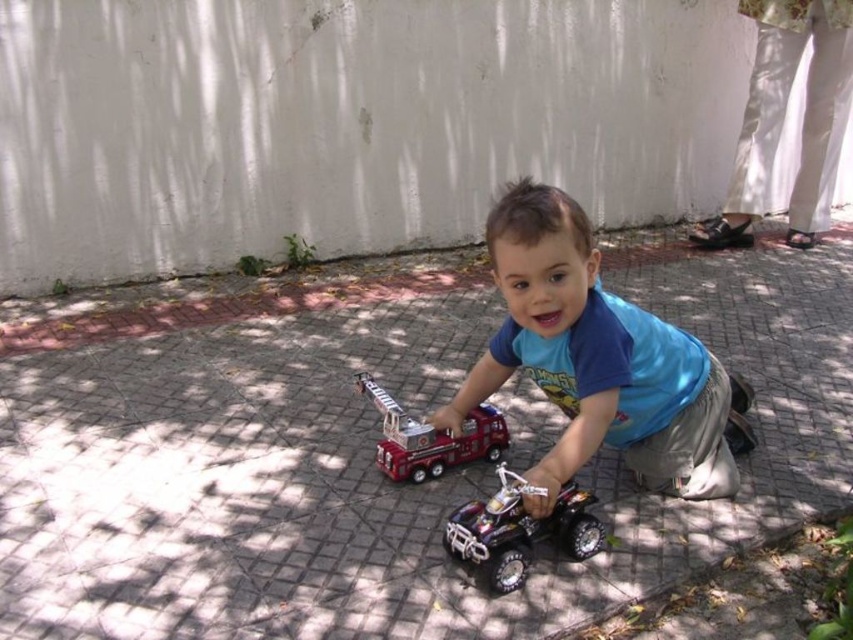
Does gray brick pavement at center have a lesser height compared to blue matte shirt at center?

In fact, gray brick pavement at center may be taller than blue matte shirt at center.

Can you confirm if gray brick pavement at center is positioned to the right of blue matte shirt at center?

Yes, gray brick pavement at center is to the right of blue matte shirt at center.

Is point (120, 378) positioned after point (651, 445)?

Yes, it is behind point (651, 445).

At what (x,y) coordinates should I click in order to perform the action: click on gray brick pavement at center. Please return your answer as a coordinate pair (x, y). The image size is (853, 640). Looking at the image, I should click on (370, 451).

Which of these two, gray brick pavement at center or shiny red fire truck at center, stands taller?

Standing taller between the two is gray brick pavement at center.

Between gray brick pavement at center and shiny red fire truck at center, which one appears on the right side from the viewer's perspective?

gray brick pavement at center

Is point (138, 483) more distant than point (503, 422)?

No, it is not.

Where is `gray brick pavement at center`? Image resolution: width=853 pixels, height=640 pixels. gray brick pavement at center is located at coordinates (370, 451).

Is blue matte shirt at center behind metallic silver quad bike at center?

That is False.

You are a GUI agent. You are given a task and a screenshot of the screen. Output one action in this format:
    pyautogui.click(x=<x>, y=<y>)
    Task: Click on the blue matte shirt at center
    
    Given the screenshot: What is the action you would take?
    pyautogui.click(x=596, y=358)